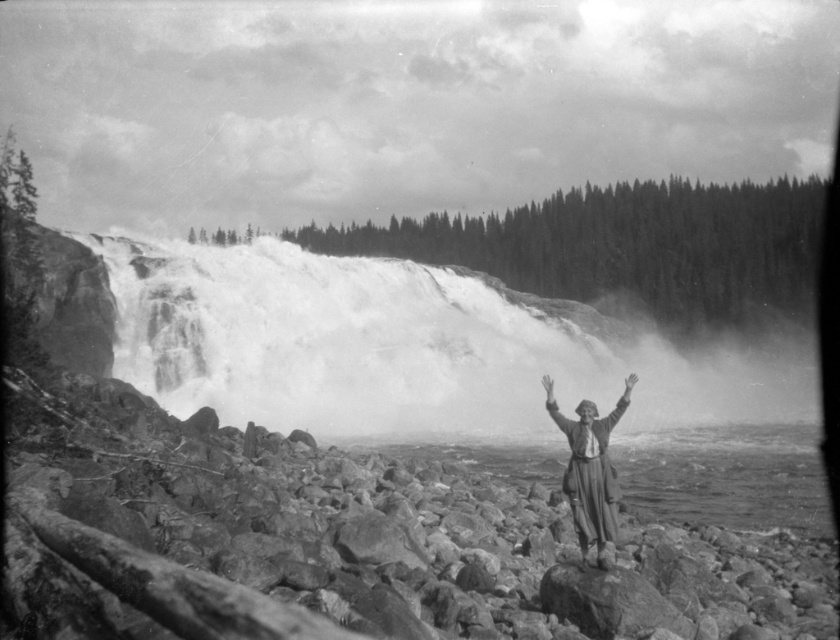
Question: Can you confirm if smooth rock at center is positioned to the left of smooth fabric person at center?

Choices:
 (A) no
 (B) yes

Answer: (B)

Question: Which point is closer to the camera?

Choices:
 (A) rugged stone waterfall at center
 (B) smooth rock at center

Answer: (B)

Question: Is smooth fabric person at center closer to camera compared to smooth skin hand at center?

Choices:
 (A) no
 (B) yes

Answer: (B)

Question: Which object is farther from the camera taking this photo?

Choices:
 (A) smooth fabric person at center
 (B) smooth rock at center
 (C) smooth skin arm at center
 (D) white matte hand at center

Answer: (D)

Question: Does smooth rock at center appear on the left side of white matte hand at center?

Choices:
 (A) no
 (B) yes

Answer: (B)

Question: Which of the following is the closest to the observer?

Choices:
 (A) smooth rock at center
 (B) smooth fabric person at center
 (C) rugged stone waterfall at center

Answer: (A)